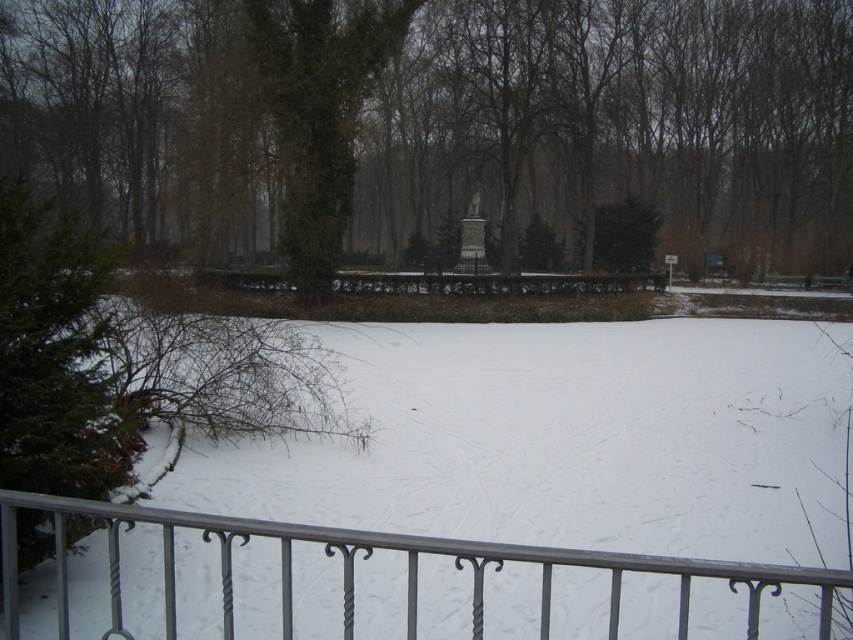
You are a gardener planning to place a new bench in the winter scene. The bench is 1.2 meters wide. You want to place it between the green leafy tree at center and the metallic silver fence at lower center. Is there enough space for the bench?

The green leafy tree at center might be wider than metallic silver fence at lower center, so the space between them may be sufficient to accommodate the 1.2 meter wide bench. However, since the exact width difference isn